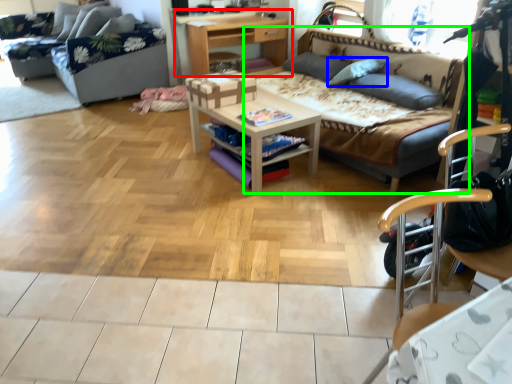
Question: Which is nearer to the desk (highlighted by a red box)? pillow (highlighted by a blue box) or studio couch (highlighted by a green box).

Choices:
 (A) pillow
 (B) studio couch

Answer: (B)